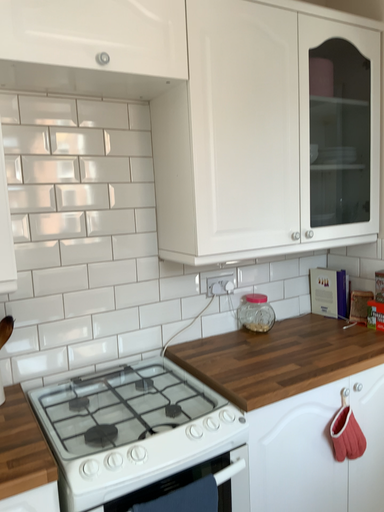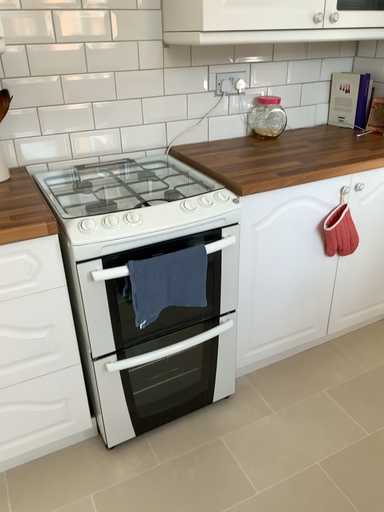
Question: Which way did the camera rotate in the video?

Choices:
 (A) rotated downward
 (B) rotated upward

Answer: (A)